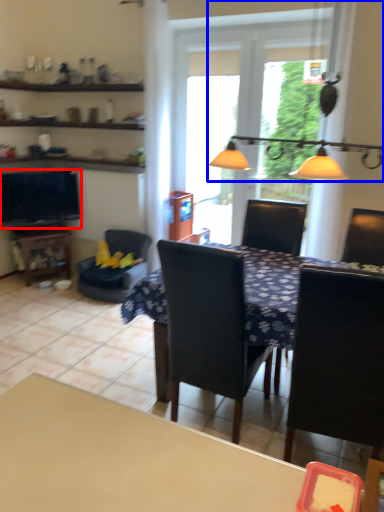
Question: Among these objects, which one is farthest to the camera, television (highlighted by a red box) or light fixture (highlighted by a blue box)?

Choices:
 (A) television
 (B) light fixture

Answer: (A)